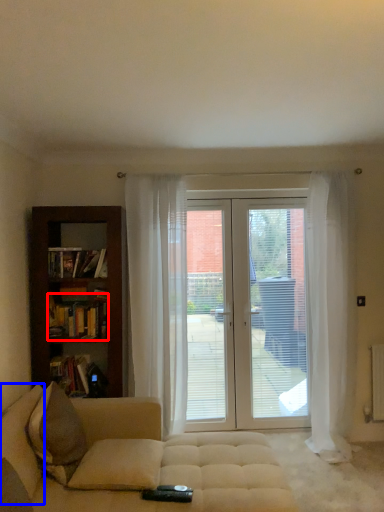
Question: Which point is further to the camera, book (highlighted by a red box) or pillow (highlighted by a blue box)?

Choices:
 (A) book
 (B) pillow

Answer: (A)